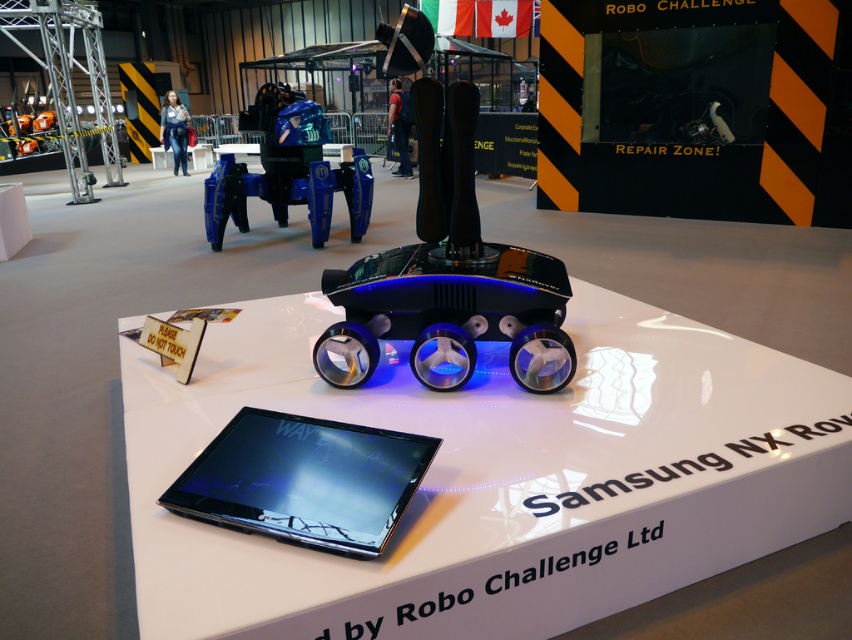
You are standing in front of the Samsung NX ROV display at the robotics exhibition. You want to take a photo of the point marked at coordinates (542, 372) without moving closer than 2 meters. Can you do this while staying at your current position?

The point at coordinates (542, 372) is 2.02 meters away from the viewer. Since you need to stay at least 2 meters away, you can take the photo from your current position as the distance is just over 2 meters.

You are a visitor at the robotics exhibition and want to interact with the Samsung NX ROV. You see the matte black tablet at center and the metallic blue robot at upper center. Which object should you look at first to control the ROV?

You should look at the metallic blue robot at upper center first because the matte black tablet at center is located below it, so the robot is positioned higher and more visible from the front.